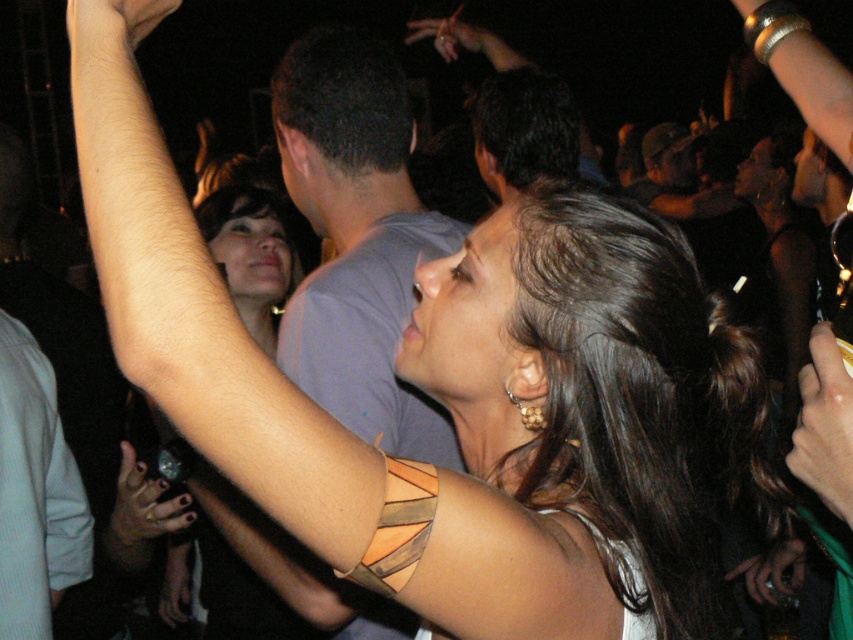
Is leather bracelet at upper left smaller than polished silver ring at upper left?

No, leather bracelet at upper left is not smaller than polished silver ring at upper left.

Is point (502, 253) closer to camera compared to point (119, 484)?

Yes, it is in front of point (119, 484).

Identify the location of leather bracelet at upper left. (560, 432).

Who is shorter, leather bracelet at upper left or smooth metallic bracelet at upper left?

smooth metallic bracelet at upper left is shorter.

Between leather bracelet at upper left and smooth metallic bracelet at upper left, which one is positioned lower?

Positioned lower is leather bracelet at upper left.

The width and height of the screenshot is (853, 640). What are the coordinates of `leather bracelet at upper left` in the screenshot? It's located at (560, 432).

Is smooth gold bracelet at upper right bigger than smooth metallic bracelet at upper left?

Yes, smooth gold bracelet at upper right is bigger than smooth metallic bracelet at upper left.

Is point (834, 412) farther from viewer compared to point (109, 1)?

Yes, it is.

Where is `smooth gold bracelet at upper right`? This screenshot has height=640, width=853. smooth gold bracelet at upper right is located at coordinates (824, 426).